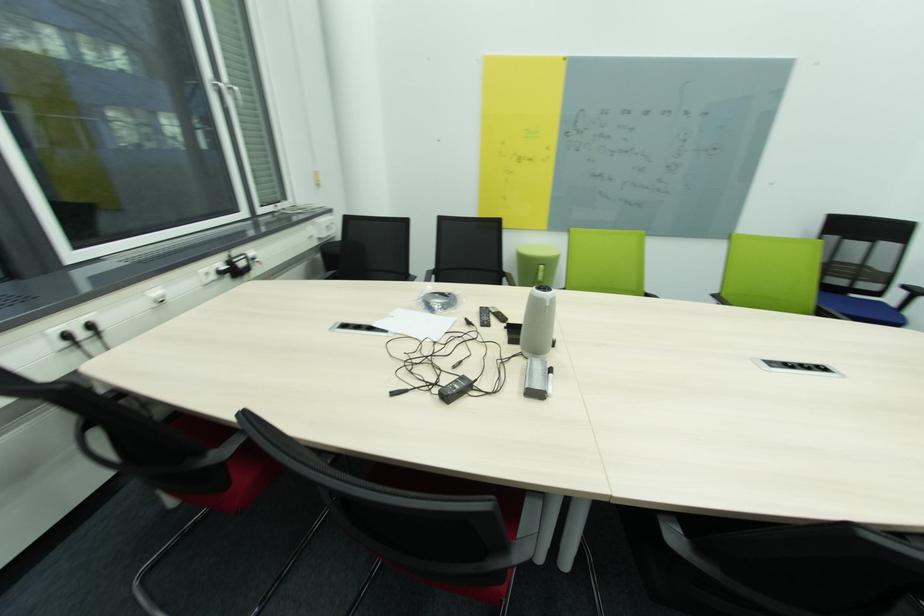
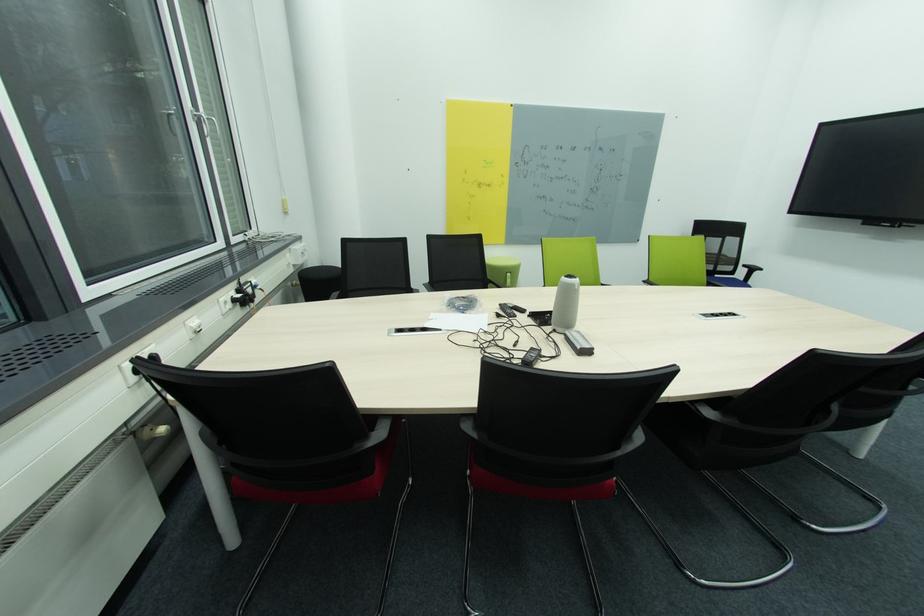
In the second image, find the point that corresponds to point (529, 354) in the first image.

(563, 331)